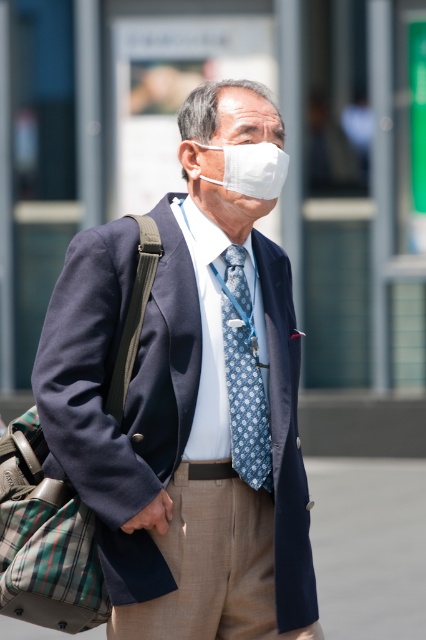
Who is more distant from viewer, (169, 234) or (265, 428)?

The point (169, 234) is more distant.

Which is in front, point (152, 292) or point (245, 474)?

Point (152, 292)

What do you see at coordinates (189, 403) in the screenshot?
I see `navy wool suit at center` at bounding box center [189, 403].

This screenshot has width=426, height=640. What are the coordinates of `navy wool suit at center` in the screenshot? It's located at (189, 403).

Does point (198, 467) come behind point (20, 470)?

Yes, point (198, 467) is farther from viewer.

Is navy wool suit at center positioned behind plaid fabric bag at left?

No, it is in front of plaid fabric bag at left.

Identify the location of navy wool suit at center. Image resolution: width=426 pixels, height=640 pixels. (189, 403).

Identify the location of navy wool suit at center. This screenshot has height=640, width=426. (189, 403).

Based on the photo, measure the distance between plaid fabric bag at left and camera.

plaid fabric bag at left is 7.07 meters from camera.

Can you confirm if plaid fabric bag at left is thinner than white matte mask at center?

In fact, plaid fabric bag at left might be wider than white matte mask at center.

Is point (37, 557) behind point (261, 193)?

No, it is not.

Find the location of `plaid fabric bag at left`. plaid fabric bag at left is located at coordinates (45, 540).